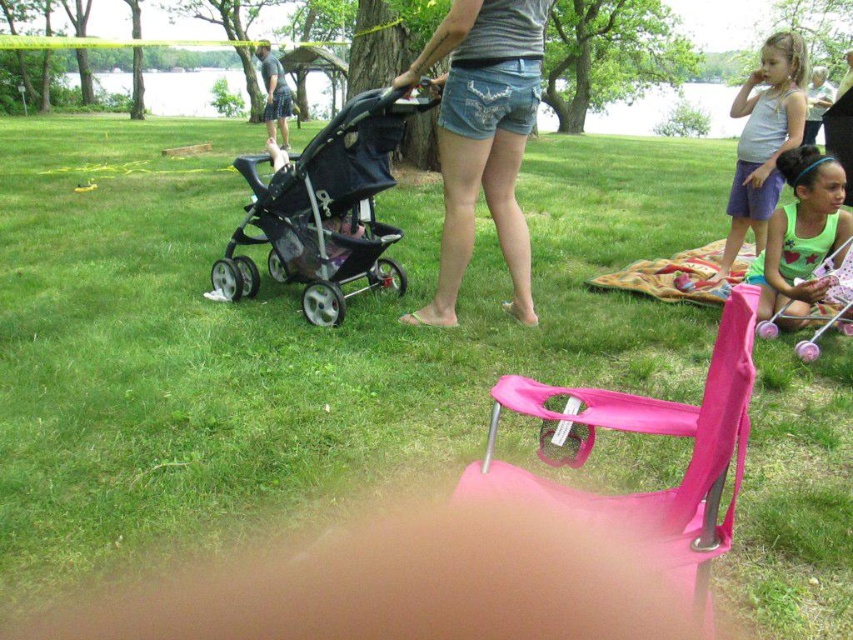
You are a photographer setting up a shoot in the park. You have a matte white tank top at upper right and a multicolored woven blanket at lower right. Which item is placed higher in the image?

The matte white tank top at upper right is positioned over the multicolored woven blanket at lower right, so it is higher in the image.

You are standing at the center of the park and want to take a photo of the black mesh stroller at center. Which direction should you move to get a better view of it?

The black mesh stroller at center is already at the center of the park, so you donot need to move. Just aim your camera towards the center to capture it clearly.